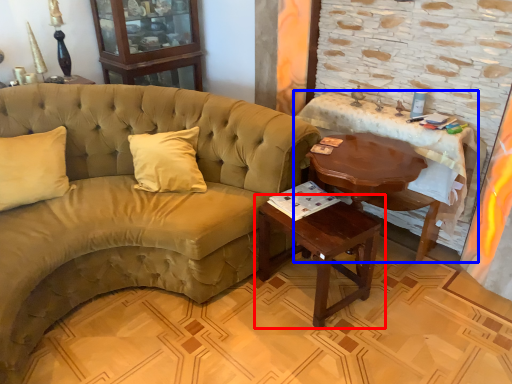
Question: Which object is further to the camera taking this photo, table (highlighted by a red box) or table (highlighted by a blue box)?

Choices:
 (A) table
 (B) table

Answer: (B)